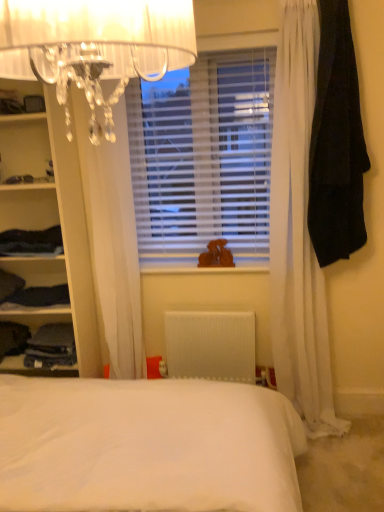
Question: Does point (1, 269) appear closer or farther from the camera than point (344, 230)?

Choices:
 (A) closer
 (B) farther

Answer: (B)

Question: From a real-world perspective, is denim pants at left, which is the fifth clothing from right to left, physically located above or below black fabric at right, the 6th clothing in the left-to-right sequence?

Choices:
 (A) below
 (B) above

Answer: (A)

Question: Which object is the closest to the denim pants at left, which is the fifth clothing from right to left?

Choices:
 (A) white plastic radiator at center
 (B) dark blue fabric at left, the 3th clothing in the right-to-left sequence
 (C) dark blue fabric at left, the second clothing viewed from the right
 (D) black fabric at right, the 1th clothing in the right-to-left sequence
 (E) white plastic blinds at center

Answer: (B)

Question: Based on their relative distances, which object is nearer to the translucent crystal chandelier at upper left?

Choices:
 (A) white plastic blinds at center
 (B) denim pants at left, which is the fifth clothing from right to left
 (C) white plastic radiator at center
 (D) black fabric at right, the 1th clothing in the right-to-left sequence
 (E) dark blue fabric at left, the 4th clothing viewed from the right

Answer: (D)